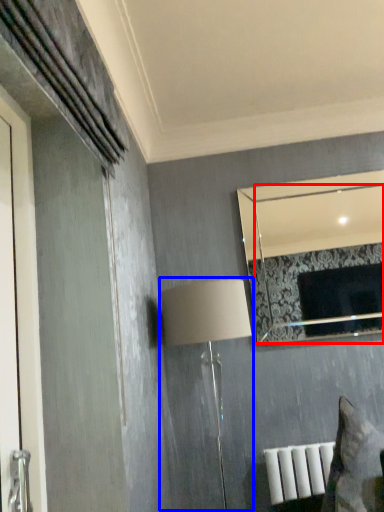
Question: Among these objects, which one is nearest to the camera, mirror (highlighted by a red box) or table lamp (highlighted by a blue box)?

Choices:
 (A) mirror
 (B) table lamp

Answer: (B)